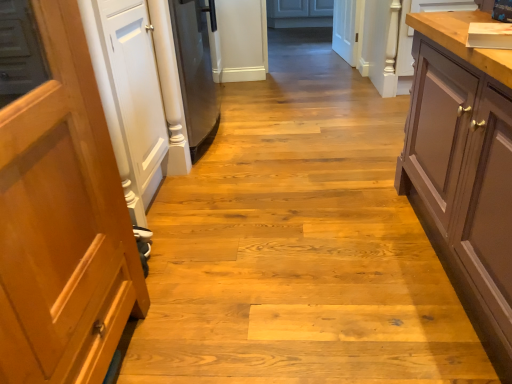
Question: In the image, is wooden countertop at upper right on the left side or the right side of matte brown cabinet at right?

Choices:
 (A) left
 (B) right

Answer: (B)

Question: From a real-world perspective, relative to matte brown cabinet at right, is wooden countertop at upper right vertically above or below?

Choices:
 (A) below
 (B) above

Answer: (A)

Question: Is wooden countertop at upper right situated inside matte brown cabinet at right or outside?

Choices:
 (A) inside
 (B) outside

Answer: (B)

Question: Is matte brown cabinet at right taller or shorter than wooden countertop at upper right?

Choices:
 (A) short
 (B) tall

Answer: (B)

Question: Considering the positions of point (421, 195) and point (507, 84), is point (421, 195) closer or farther from the camera than point (507, 84)?

Choices:
 (A) farther
 (B) closer

Answer: (A)

Question: From a real-world perspective, is matte brown cabinet at right physically located above or below wooden countertop at upper right?

Choices:
 (A) below
 (B) above

Answer: (B)

Question: In the image, is matte brown cabinet at right positioned in front of or behind wooden countertop at upper right?

Choices:
 (A) front
 (B) behind

Answer: (A)